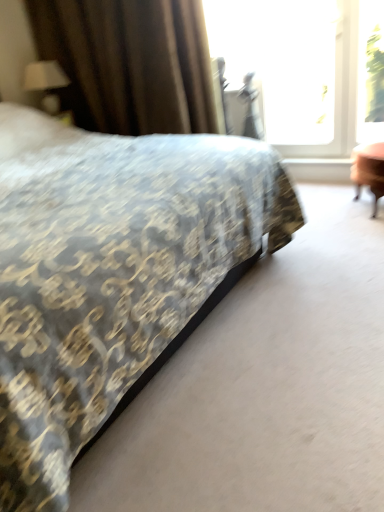
Question: Is point (46, 65) closer or farther from the camera than point (84, 20)?

Choices:
 (A) farther
 (B) closer

Answer: (A)

Question: From the image's perspective, is matte white lampshade at upper left located above or below brown textured curtain at upper left?

Choices:
 (A) below
 (B) above

Answer: (A)

Question: Which object is positioned closest to the transparent glass window screen at upper right?

Choices:
 (A) patterned fabric bed at center
 (B) brown textured curtain at upper left
 (C) transparent glass window at upper right
 (D) matte white lampshade at upper left

Answer: (C)

Question: Which is farther from the transparent glass window screen at upper right?

Choices:
 (A) transparent glass window at upper right
 (B) patterned fabric bed at center
 (C) brown textured curtain at upper left
 (D) matte white lampshade at upper left

Answer: (D)